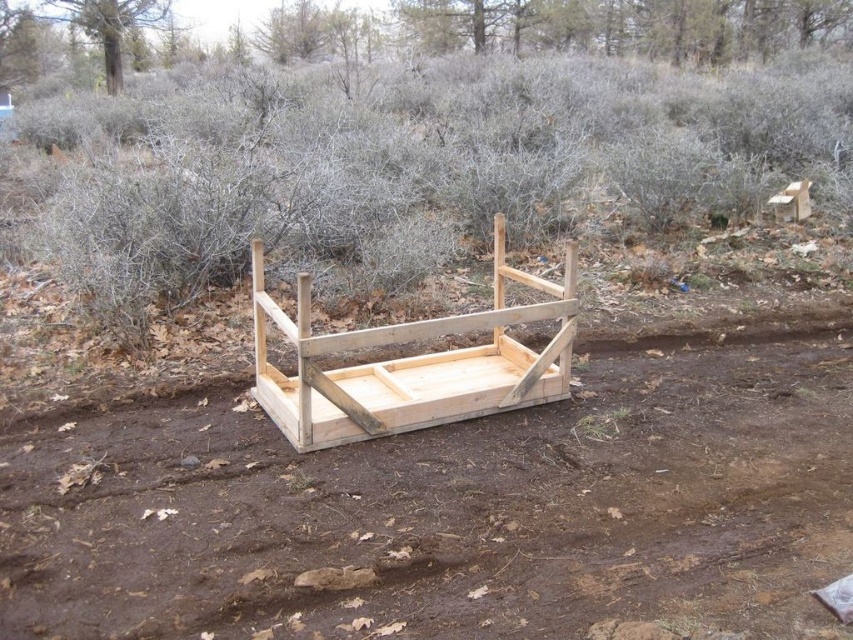
Question: Can you confirm if natural wood mud tray at center is positioned to the right of light brown wood bed frame at center?

Choices:
 (A) no
 (B) yes

Answer: (B)

Question: Does natural wood mud tray at center have a lesser width compared to light brown wood bed frame at center?

Choices:
 (A) yes
 (B) no

Answer: (B)

Question: Observing the image, what is the correct spatial positioning of natural wood mud tray at center in reference to light brown wood bed frame at center?

Choices:
 (A) left
 (B) right

Answer: (B)

Question: Which of the following is the farthest from the observer?

Choices:
 (A) (531, 484)
 (B) (383, 387)

Answer: (B)

Question: Which point appears closest to the camera in this image?

Choices:
 (A) (154, 609)
 (B) (456, 371)

Answer: (A)